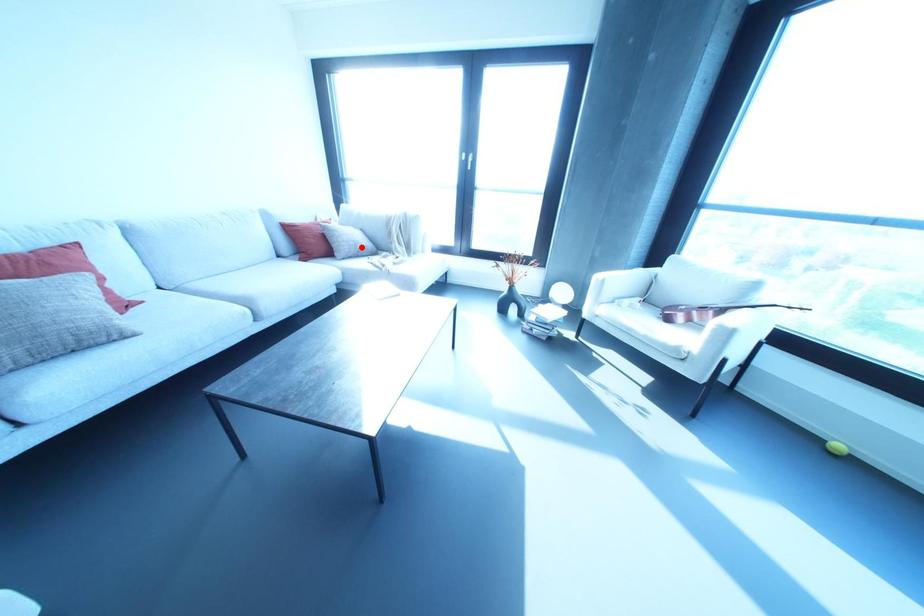
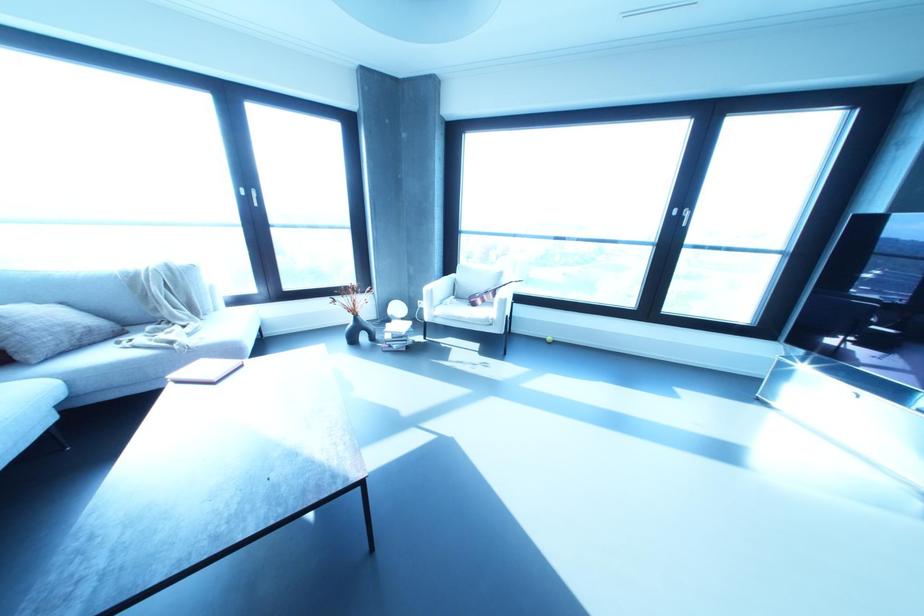
Locate, in the second image, the point that corresponds to the highlighted location in the first image.

(90, 330)